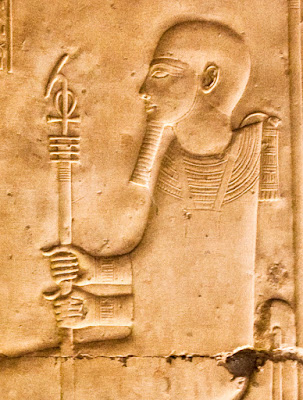
Image resolution: width=303 pixels, height=400 pixels. Find the location of `crack on the wall`. crack on the wall is located at coordinates (50, 354), (110, 357), (159, 356), (193, 356).